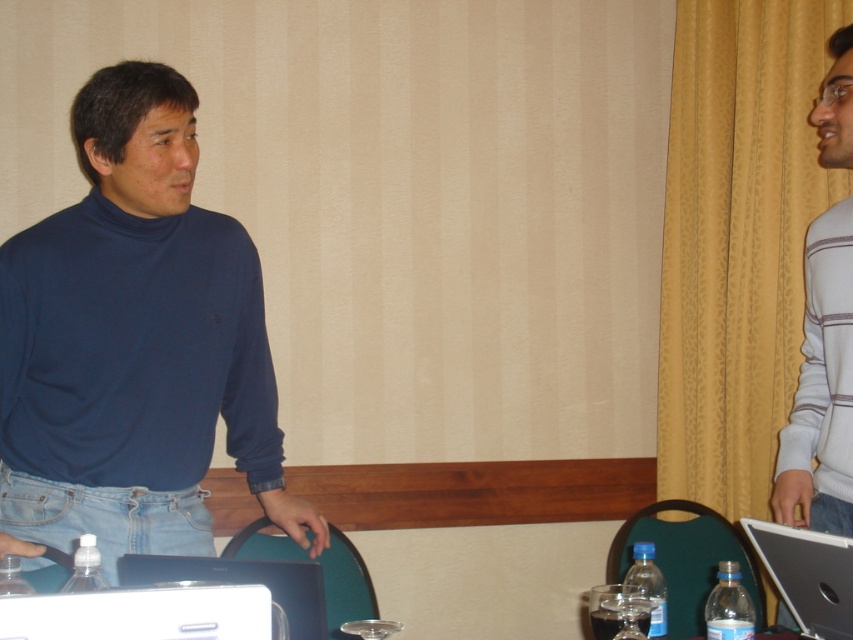
Does matte blue turtleneck sweater at left appear under black glossy laptop at lower left?

No.

Can you confirm if matte blue turtleneck sweater at left is shorter than black glossy laptop at lower left?

No.

This screenshot has height=640, width=853. Find the location of `matte blue turtleneck sweater at left`. matte blue turtleneck sweater at left is located at coordinates (134, 342).

Who is taller, yellow textured curtain at upper right or gray striped sweater at right?

yellow textured curtain at upper right

Is yellow textured curtain at upper right wider than gray striped sweater at right?

Correct, the width of yellow textured curtain at upper right exceeds that of gray striped sweater at right.

Which is in front, point (720, 300) or point (833, 140)?

Positioned in front is point (833, 140).

You are a GUI agent. You are given a task and a screenshot of the screen. Output one action in this format:
    pyautogui.click(x=<x>, y=<y>)
    Task: Click on the yellow textured curtain at upper right
    
    Given the screenshot: What is the action you would take?
    pyautogui.click(x=737, y=240)

Can you confirm if gray striped sweater at right is smaller than black glossy laptop at lower left?

No.

Measure the distance between point (828, 348) and camera.

The distance of point (828, 348) from camera is 6.80 feet.

This screenshot has height=640, width=853. What do you see at coordinates (821, 387) in the screenshot?
I see `gray striped sweater at right` at bounding box center [821, 387].

You are a GUI agent. You are given a task and a screenshot of the screen. Output one action in this format:
    pyautogui.click(x=<x>, y=<y>)
    Task: Click on the gray striped sweater at right
    Image resolution: width=853 pixels, height=640 pixels.
    Given the screenshot: What is the action you would take?
    click(821, 387)